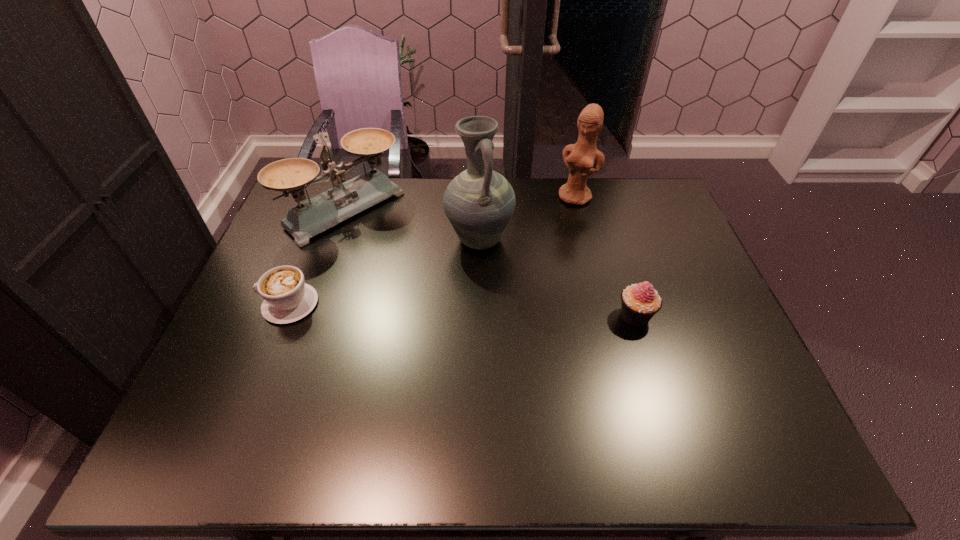
Image resolution: width=960 pixels, height=540 pixels. What are the coordinates of `cappuccino positioned at the left edge` in the screenshot? It's located at (287, 298).

What are the coordinates of `scale located in the left edge section of the desktop` in the screenshot? It's located at (315, 215).

Find the location of `object that is at the far left corner`. object that is at the far left corner is located at coordinates (315, 215).

Image resolution: width=960 pixels, height=540 pixels. I want to click on vacant area at the far edge, so click(449, 183).

In the image, there is a desktop. Find the location of `free space at the near edge`. free space at the near edge is located at coordinates (317, 384).

You are a GUI agent. You are given a task and a screenshot of the screen. Output one action in this format:
    pyautogui.click(x=<x>, y=<y>)
    Task: Click on the free region at the left edge of the desktop
    The image size is (960, 540).
    Given the screenshot: What is the action you would take?
    pyautogui.click(x=298, y=257)

In the image, there is a desktop. Where is `vacant space at the right edge`? The image size is (960, 540). vacant space at the right edge is located at coordinates (694, 349).

I want to click on vacant region at the far right corner of the desktop, so click(x=636, y=183).

This screenshot has width=960, height=540. In the image, there is a desktop. What are the coordinates of `free space at the near right corner` in the screenshot? It's located at (707, 393).

Where is `vacant point located between the second tallest object and the shortest object`? vacant point located between the second tallest object and the shortest object is located at coordinates (433, 251).